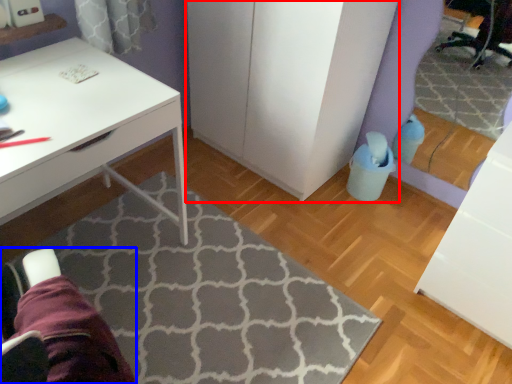
Question: Which object is closer to the camera taking this photo, dresser (highlighted by a red box) or swivel chair (highlighted by a blue box)?

Choices:
 (A) dresser
 (B) swivel chair

Answer: (B)